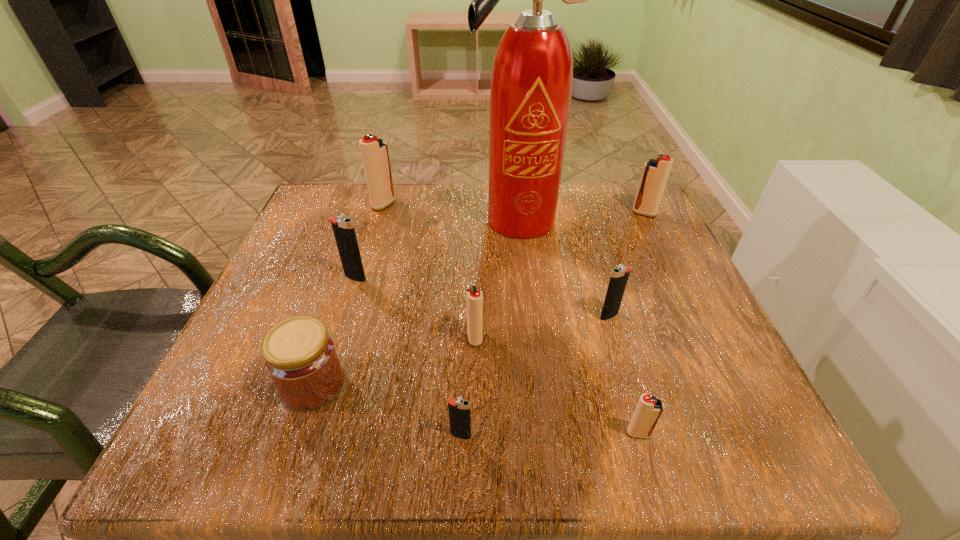
You are a GUI agent. You are given a task and a screenshot of the screen. Output one action in this format:
    pyautogui.click(x=<x>, y=<y>)
    Task: Click on the fifth farthest igniter
    Image resolution: width=960 pixels, height=540 pixels.
    Given the screenshot: What is the action you would take?
    pyautogui.click(x=474, y=297)

This screenshot has width=960, height=540. What are the coordinates of `the third farthest red igniter` in the screenshot? It's located at (474, 297).

Where is `red jam`? The width and height of the screenshot is (960, 540). red jam is located at coordinates (300, 356).

You are a GUI agent. You are given a task and a screenshot of the screen. Output one action in this format:
    pyautogui.click(x=<x>, y=<y>)
    Task: Click on the jam
    Image resolution: width=960 pixels, height=540 pixels.
    Given the screenshot: What is the action you would take?
    pyautogui.click(x=300, y=356)

Locate an element on the screen. This screenshot has width=960, height=540. the third red igniter from left to right is located at coordinates coord(649,409).

Locate an element on the screen. This screenshot has height=540, width=960. the smallest red igniter is located at coordinates (649, 409).

Where is `the smallest black igniter`? the smallest black igniter is located at coordinates (459, 409).

The height and width of the screenshot is (540, 960). What are the coordinates of `the second black igniter from right to left` in the screenshot? It's located at (459, 409).

The image size is (960, 540). In order to click on vacant region located 0.220m on the left of the tallest object in this screenshot , I will do `click(377, 220)`.

Locate an element on the screen. free spot located on the right of the leftmost red igniter is located at coordinates (415, 205).